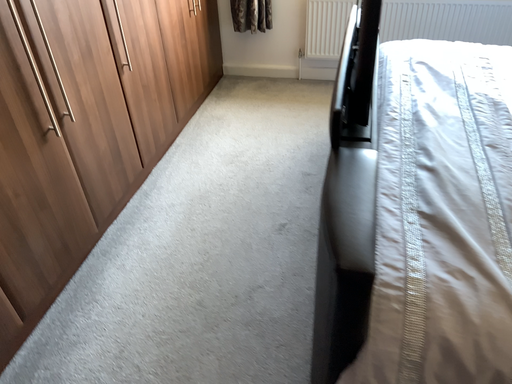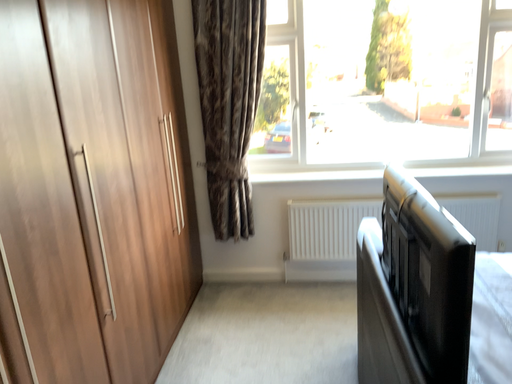
Question: Which way did the camera rotate in the video?

Choices:
 (A) rotated upward
 (B) rotated downward

Answer: (A)